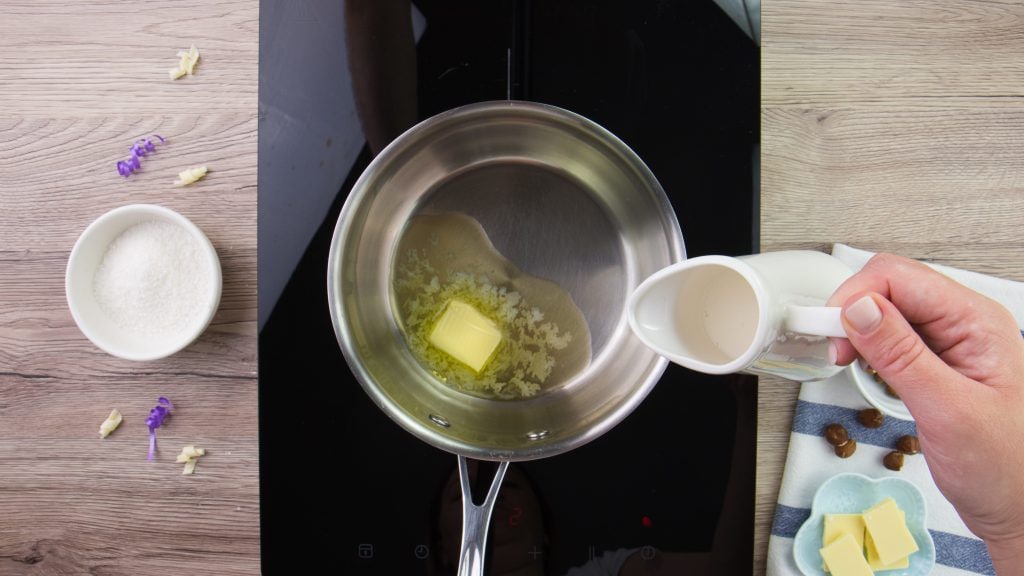
Locate an element on the screen. small white bowl is located at coordinates (83, 263).